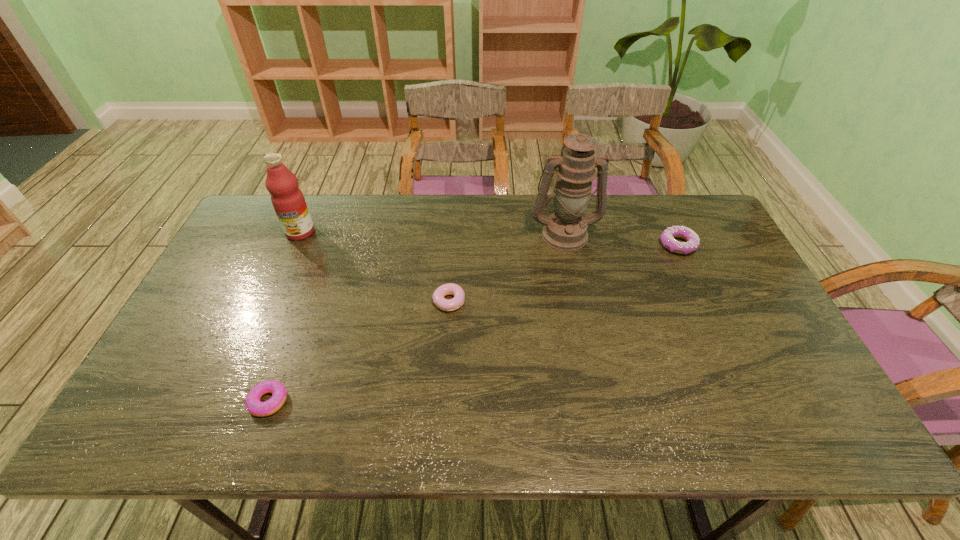
Locate an element on the screen. free spot located 0.190m on the left of the tallest object is located at coordinates (471, 234).

Identify the location of blank area located on the label of the second tallest object. The image size is (960, 540). (266, 312).

Image resolution: width=960 pixels, height=540 pixels. What are the coordinates of `vacant space located on the left of the rightmost doughnut` in the screenshot? It's located at pos(559,245).

Where is `free region located 0.300m on the back of the second farthest doughnut`? Image resolution: width=960 pixels, height=540 pixels. free region located 0.300m on the back of the second farthest doughnut is located at coordinates (454, 224).

Identify the location of vacant space located 0.080m on the left of the second object from left to right. (215, 401).

Where is `oil lamp that is at the far edge`? oil lamp that is at the far edge is located at coordinates (566, 229).

Where is `fruit juice that is at the far edge`? The image size is (960, 540). fruit juice that is at the far edge is located at coordinates (288, 201).

Locate an element on the screen. The height and width of the screenshot is (540, 960). doughnut located at the far edge is located at coordinates (692, 243).

Locate an element on the screen. The height and width of the screenshot is (540, 960). object situated at the near edge is located at coordinates (257, 408).

Find the location of a particular element. object that is positioned at the left edge is located at coordinates (288, 201).